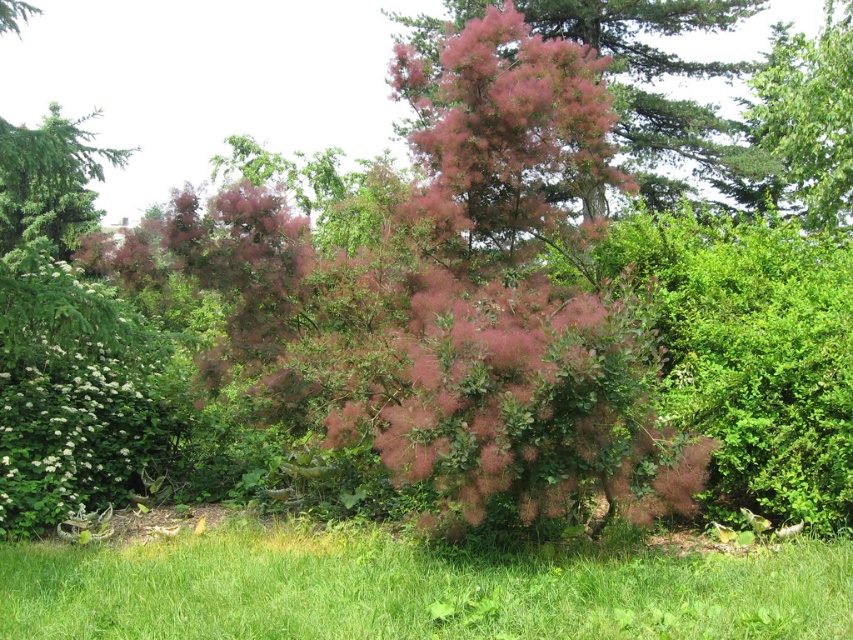
Is pink fluffy bush at center wider than green leafy tree at upper right?

Incorrect, pink fluffy bush at center's width does not surpass green leafy tree at upper right's.

Is point (682, 156) more distant than point (843, 104)?

Yes, point (682, 156) is farther from viewer.

Is point (575, 19) farther from viewer compared to point (758, 125)?

No.

At what (x,y) coordinates should I click in order to perform the action: click on pink fluffy bush at center. Please return your answer as a coordinate pair (x, y). Image resolution: width=853 pixels, height=640 pixels. Looking at the image, I should click on (648, 67).

Is white fluffy bush at lower left above green leafy tree at upper right?

Actually, white fluffy bush at lower left is below green leafy tree at upper right.

What do you see at coordinates (73, 428) in the screenshot? I see `white fluffy bush at lower left` at bounding box center [73, 428].

Identify the location of white fluffy bush at lower left. Image resolution: width=853 pixels, height=640 pixels. (73, 428).

Is white fluffy bush at lower left bigger than green textured tree at upper left?

Incorrect, white fluffy bush at lower left is not larger than green textured tree at upper left.

Who is more forward, (129, 403) or (15, 216)?

Point (129, 403) is in front.

Is point (35, 506) closer to viewer compared to point (20, 198)?

Yes.

This screenshot has width=853, height=640. I want to click on white fluffy bush at lower left, so click(x=73, y=428).